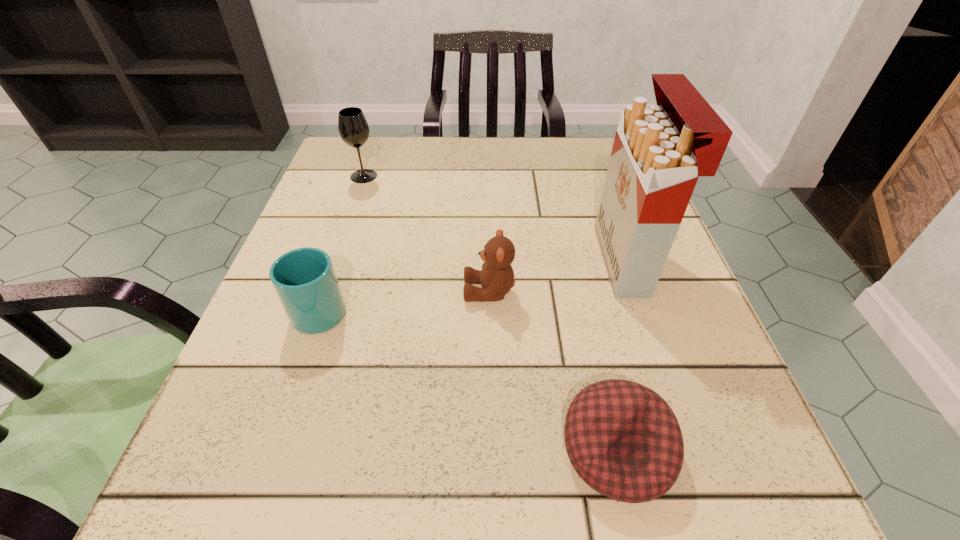
This screenshot has width=960, height=540. Identify the location of the tallest object. (659, 151).

Find the location of a particular element. the farthest object is located at coordinates (353, 128).

Locate an element on the screen. This screenshot has width=960, height=540. wineglass is located at coordinates (353, 128).

Where is `the third object from right to left`? Image resolution: width=960 pixels, height=540 pixels. the third object from right to left is located at coordinates (497, 276).

What are the coordinates of `cup` in the screenshot? It's located at (304, 279).

The image size is (960, 540). I want to click on beanbag, so click(x=624, y=441).

Identify the location of the nearest object. The width and height of the screenshot is (960, 540). (624, 441).

Identify the location of vacant space located with the lid open on the cigarette case. (463, 261).

The width and height of the screenshot is (960, 540). Find the location of `vacant space situated 0.250m with the lid open on the cigarette case`. vacant space situated 0.250m with the lid open on the cigarette case is located at coordinates (463, 261).

Locate an element on the screen. The image size is (960, 540). free location located 0.330m with the lid open on the cigarette case is located at coordinates (418, 261).